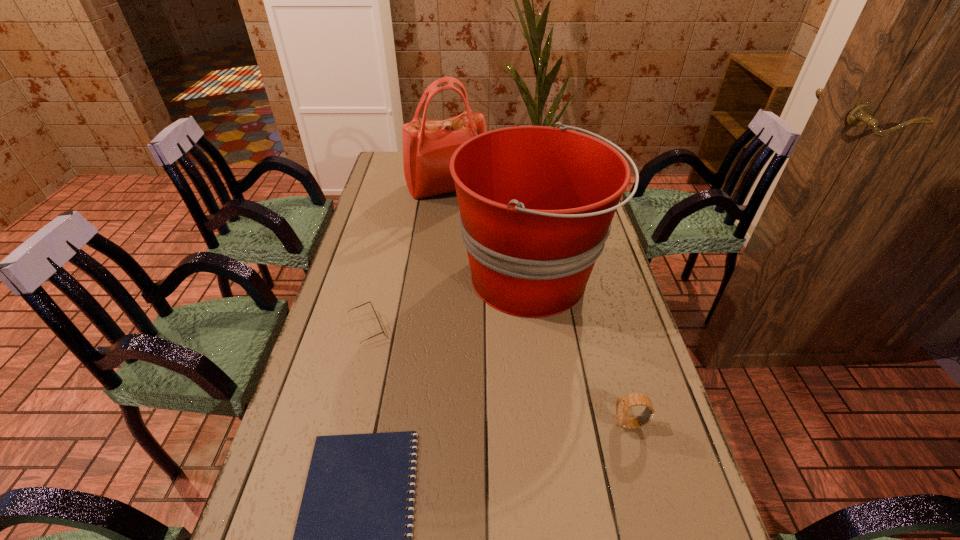
Identify the location of object that is at the far edge. (428, 145).

Locate an element on the screen. The height and width of the screenshot is (540, 960). handbag at the left edge is located at coordinates coord(428,145).

In order to click on spectacles that is at the left edge in this screenshot , I will do `click(369, 301)`.

The image size is (960, 540). Find the location of `bucket that is positioned at the right edge`. bucket that is positioned at the right edge is located at coordinates (536, 203).

Identify the location of watch positioned at the right edge. This screenshot has width=960, height=540. (623, 404).

Locate an element on the screen. The height and width of the screenshot is (540, 960). object that is at the far left corner is located at coordinates (428, 145).

This screenshot has height=540, width=960. I want to click on vacant area at the left edge of the desktop, so click(x=385, y=254).

In the image, there is a desktop. Where is `vacant space at the right edge`? vacant space at the right edge is located at coordinates (634, 435).

The width and height of the screenshot is (960, 540). I want to click on vacant space in between the third shortest object and the bucket, so [581, 351].

The width and height of the screenshot is (960, 540). I want to click on vacant space that is in between the bucket and the third shortest object, so click(581, 351).